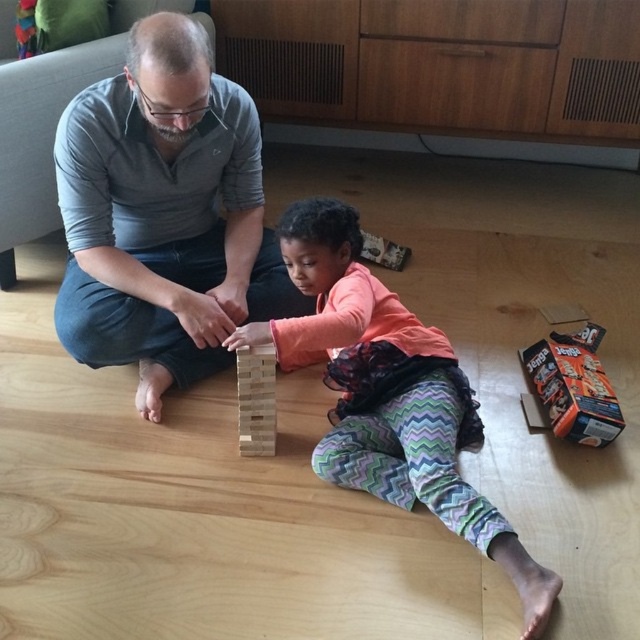
Between point (72, 177) and point (381, 346), which one is positioned behind?

The point (72, 177) is behind.

Is point (96, 307) more distant than point (445, 413)?

Yes.

The image size is (640, 640). What do you see at coordinates (163, 214) in the screenshot?
I see `matte gray shirt at upper left` at bounding box center [163, 214].

What are the coordinates of `matte gray shirt at upper left` in the screenshot? It's located at (163, 214).

Which of these two, orange cardboard box at lower right or wooden block at center, stands shorter?

wooden block at center

Is orange cardboard box at lower right shorter than wooden block at center?

Incorrect, orange cardboard box at lower right's height does not fall short of wooden block at center's.

Where is `orange cardboard box at lower right`? orange cardboard box at lower right is located at coordinates click(573, 387).

Does matte wooden blocks at center have a greater height compared to wooden block at center?

Yes.

Is matte wooden blocks at center further to the viewer compared to wooden block at center?

No, it is in front of wooden block at center.

Who is more forward, (324,456) or (248,385)?

Point (324,456) is in front.

Identify the location of matte wooden blocks at center. (388, 394).